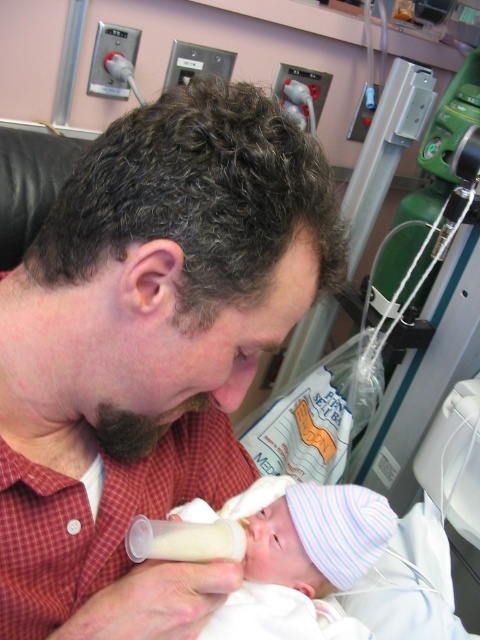
You are a nurse in a hospital room and need to access the white striped knit hat at center to check the baby. However, the red checkered shirt at center is in the way. Can you easily reach the hat without moving the shirt?

The red checkered shirt at center is positioned over the white striped knit hat at center, so you cannot easily reach the hat without moving the shirt.

Looking at this image, you are a nurse in the hospital room and need to quickly access the white striped knit hat at center while attending to the baby. However, the red checkered shirt at center is blocking your path. Can you move around the shirt to reach the hat without disturbing the feeding?

The red checkered shirt at center is positioned on the left side of white striped knit hat at center, so you can move around the right side of the shirt to reach the hat without disturbing the feeding.